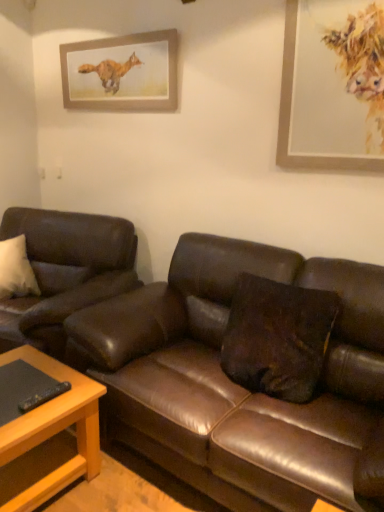
Question: Based on their positions, is brown leather couch at center, arranged as the 2th studio couch when viewed from the left, located to the left or right of wooden picture frame at upper right, which appears as the 2th picture frame when viewed from the left?

Choices:
 (A) right
 (B) left

Answer: (B)

Question: In terms of size, does brown leather couch at center, arranged as the 2th studio couch when viewed from the left, appear bigger or smaller than wooden picture frame at upper right, which ranks as the 2th picture frame in back-to-front order?

Choices:
 (A) big
 (B) small

Answer: (A)

Question: Estimate the real-world distances between objects in this image. Which object is farther from the brown leather couch at center, which appears as the first studio couch when viewed from the right?

Choices:
 (A) light brown wooden table at lower left
 (B) brown leather pillow at center
 (C) leather couch at left, the 2th studio couch from the right
 (D) wooden picture frame at upper center, which is the 1th picture frame in left-to-right order
 (E) wooden picture frame at upper right, which is the 1th picture frame in right-to-left order

Answer: (D)

Question: Considering the real-world distances, which object is closest to the leather couch at left, arranged as the first studio couch when viewed from the left?

Choices:
 (A) brown leather pillow at center
 (B) wooden picture frame at upper right, which ranks as the 2th picture frame in back-to-front order
 (C) brown leather couch at center, which appears as the first studio couch when viewed from the right
 (D) wooden picture frame at upper center, the second picture frame from the front
 (E) light brown wooden table at lower left

Answer: (E)